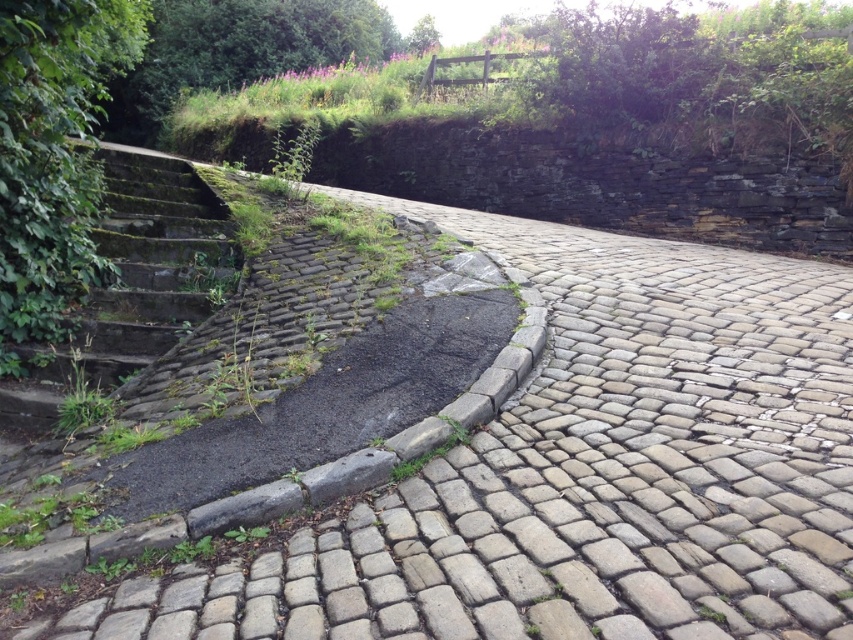
Can you confirm if gray cobblestone pavement at center is positioned to the right of mossy stone stairs at left?

Yes, gray cobblestone pavement at center is to the right of mossy stone stairs at left.

Where is `gray cobblestone pavement at center`? gray cobblestone pavement at center is located at coordinates (587, 474).

Locate an element on the screen. The width and height of the screenshot is (853, 640). gray cobblestone pavement at center is located at coordinates (587, 474).